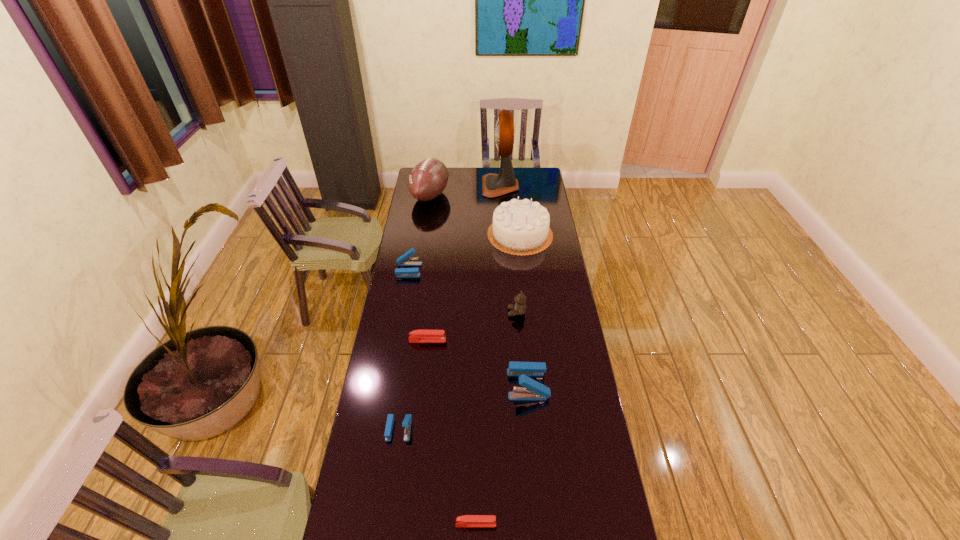
This screenshot has height=540, width=960. Find the location of `vacant area located on the front of the third farthest object`. vacant area located on the front of the third farthest object is located at coordinates (525, 278).

This screenshot has height=540, width=960. In order to click on vacant space located on the right of the biggest blue stapler in this screenshot , I will do `click(562, 384)`.

At what (x,y) coordinates should I click in order to perform the action: click on vacant space located on the face of the teddy bear. Please return your answer as a coordinate pair (x, y). The height and width of the screenshot is (540, 960). Looking at the image, I should click on (424, 313).

This screenshot has height=540, width=960. Find the location of `free region located 0.350m on the face of the teddy bear`. free region located 0.350m on the face of the teddy bear is located at coordinates (426, 313).

In order to click on vacant space located 0.390m on the face of the teddy bear in this screenshot , I will do `click(418, 313)`.

Where is `vacant space located 0.110m on the front of the sixth nearest object`? vacant space located 0.110m on the front of the sixth nearest object is located at coordinates (404, 295).

This screenshot has width=960, height=540. In order to click on vacant space positioned on the left of the nearest blue stapler in this screenshot , I will do `click(372, 429)`.

This screenshot has width=960, height=540. In order to click on vacant space located 0.310m on the front-facing side of the second shortest object in this screenshot , I will do `click(522, 340)`.

At what (x,y) coordinates should I click in order to perform the action: click on vacant space located 0.360m on the front-facing side of the right red stapler. Please return your answer as a coordinate pair (x, y). The image size is (960, 540). Looking at the image, I should click on (619, 524).

This screenshot has width=960, height=540. Find the location of `fan that is at the far edge`. fan that is at the far edge is located at coordinates (493, 185).